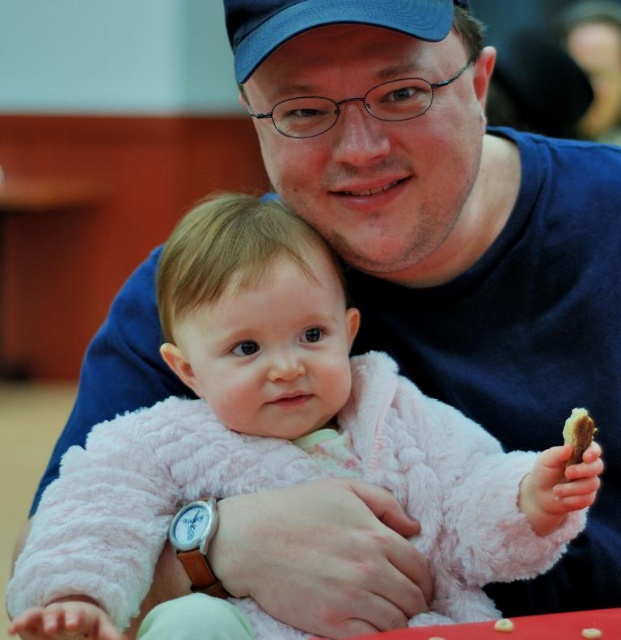
Is pink fluffy sweater at center thinner than brown crumbly cookie at center?

Incorrect, pink fluffy sweater at center's width is not less than brown crumbly cookie at center's.

Is pink fluffy sweater at center below brown crumbly cookie at center?

Incorrect, pink fluffy sweater at center is not positioned below brown crumbly cookie at center.

Which is behind, point (214, 234) or point (597, 637)?

Point (214, 234)

Find the location of a particular element. The width and height of the screenshot is (621, 640). pink fluffy sweater at center is located at coordinates (278, 436).

Can you confirm if brown crumbly cookie at lower right is positioned below yellow crumbly cookie at lower center?

Incorrect, brown crumbly cookie at lower right is not positioned below yellow crumbly cookie at lower center.

Based on the photo, who is more forward, (573, 464) or (504, 630)?

Positioned in front is point (573, 464).

Identify the location of brown crumbly cookie at lower right. (578, 433).

Between pink fluffy sweater at center and blue fabric baseball cap at upper center, which one has more height?

pink fluffy sweater at center

Between point (152, 547) and point (360, 12), which one is positioned in front?

Point (360, 12) is in front.

Find the location of `pink fluffy sweater at center`. pink fluffy sweater at center is located at coordinates (278, 436).